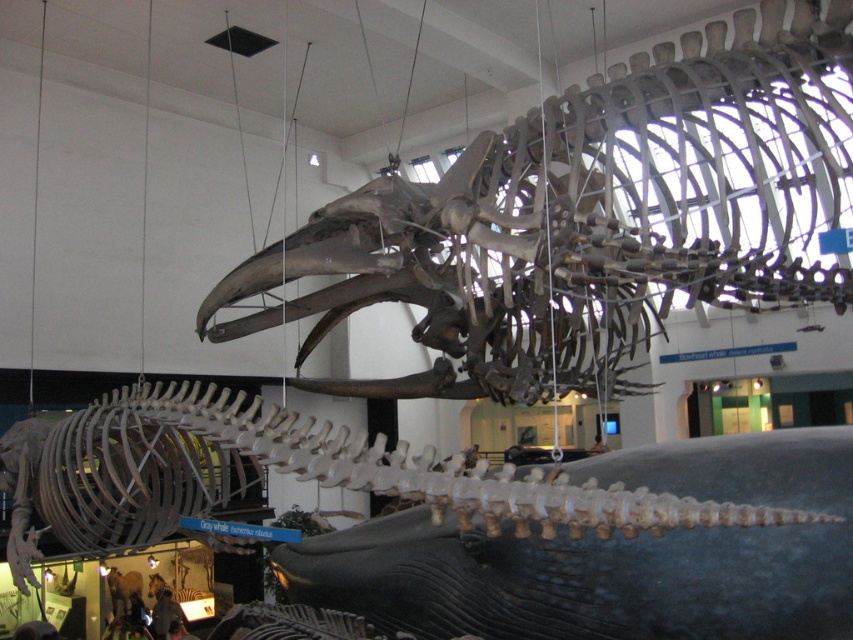
Is bone-like skeleton at upper center closer to camera compared to smooth gray whale at center?

No, bone-like skeleton at upper center is behind smooth gray whale at center.

Can you confirm if bone-like skeleton at upper center is bigger than smooth gray whale at center?

Yes.

Measure the distance between point (546, 106) and camera.

Point (546, 106) and camera are 14.53 feet apart from each other.

Where is `bone-like skeleton at upper center`? The image size is (853, 640). bone-like skeleton at upper center is located at coordinates (590, 218).